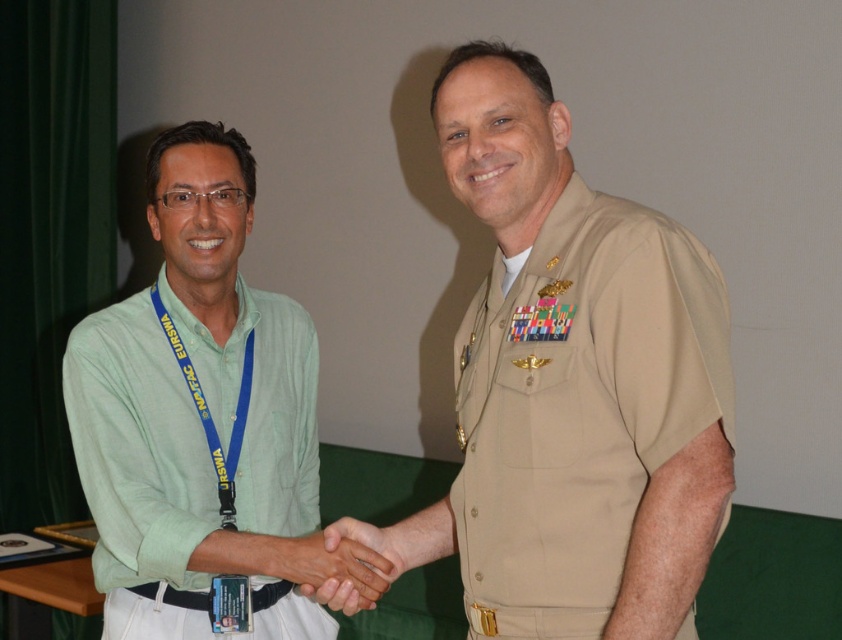
You are a photographer trying to capture a closeup of the tan uniform at center without the smooth skin handshake at center overlapping. Can you adjust your camera angle to achieve this?

The tan uniform at center might be wider than the smooth skin handshake at center, so adjusting the camera angle to focus on the tan uniform at center while avoiding the handshake area could work.

Based on the coordinates provided, which object corresponds to the point at (203, 420)?

The point at (203, 420) corresponds to the green cotton shirt at left.